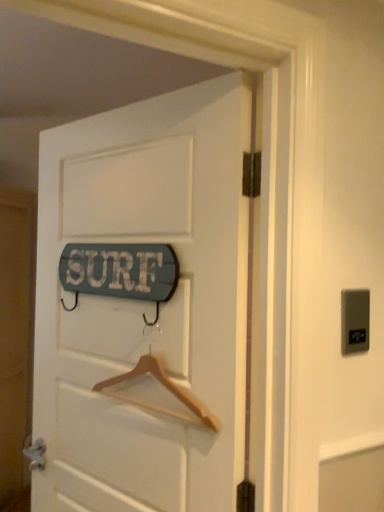
Question: Is wooden signboard at center in front of or behind gray plastic electric outlet at upper right in the image?

Choices:
 (A) front
 (B) behind

Answer: (A)

Question: Considering the positions of point (140, 420) and point (345, 309), is point (140, 420) closer or farther from the camera than point (345, 309)?

Choices:
 (A) farther
 (B) closer

Answer: (A)

Question: Which object is the farthest from the gray plastic electric outlet at upper right?

Choices:
 (A) wooden signboard at center
 (B) wooden hanger at center

Answer: (A)

Question: Which of these objects is positioned closest to the wooden signboard at center?

Choices:
 (A) wooden hanger at center
 (B) gray plastic electric outlet at upper right

Answer: (A)